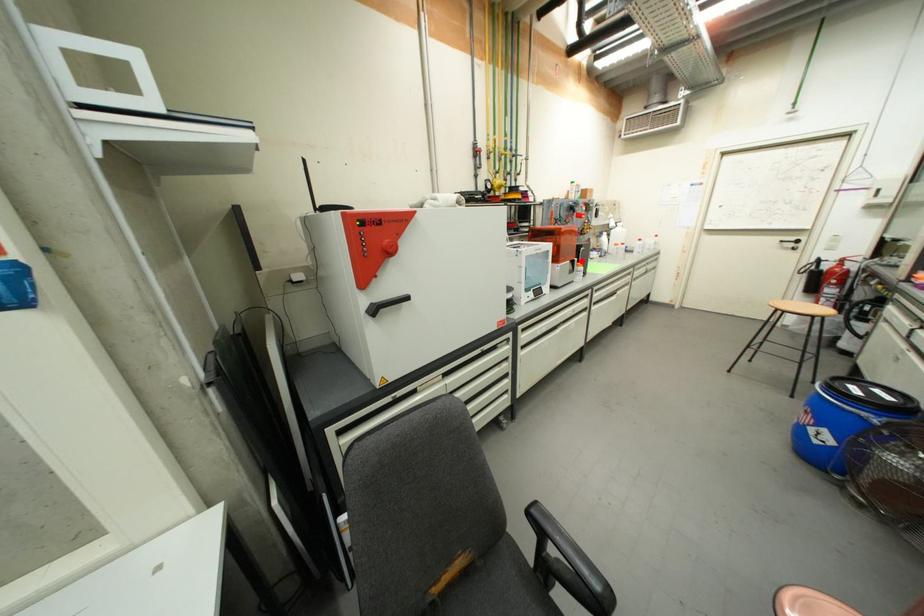
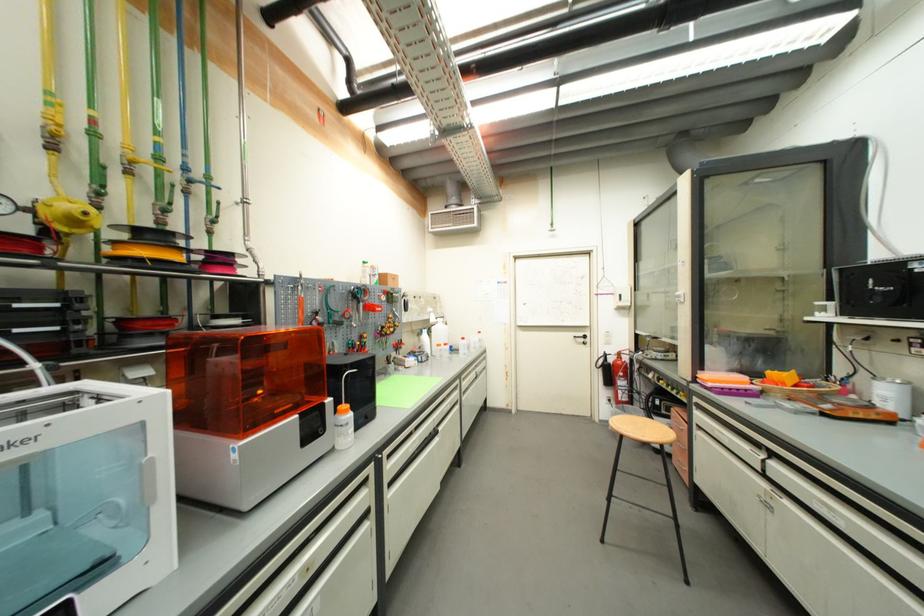
Find the pixel in the second image that matches the highlighted location in the first image.

(334, 402)